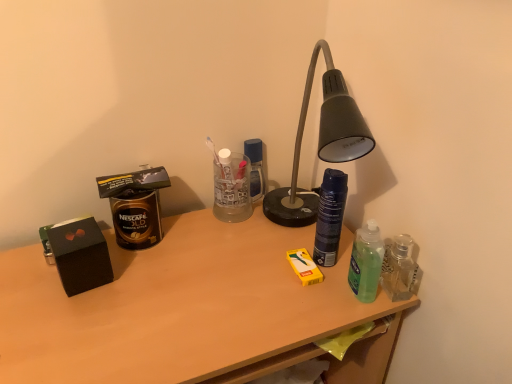
Question: Could you tell me if dark blue matte spray can at center, positioned as the 1th bottle in left-to-right order, is facing wooden desk at center?

Choices:
 (A) yes
 (B) no

Answer: (B)

Question: Is dark blue matte spray can at center, the second bottle from the right, to the right of wooden desk at center from the viewer's perspective?

Choices:
 (A) no
 (B) yes

Answer: (B)

Question: Is dark blue matte spray can at center, the second bottle from the right, smaller than wooden desk at center?

Choices:
 (A) yes
 (B) no

Answer: (A)

Question: Is the depth of dark blue matte spray can at center, positioned as the 1th bottle in left-to-right order, less than that of wooden desk at center?

Choices:
 (A) yes
 (B) no

Answer: (B)

Question: Would you consider dark blue matte spray can at center, positioned as the 1th bottle in left-to-right order, to be distant from wooden desk at center?

Choices:
 (A) no
 (B) yes

Answer: (A)

Question: Considering the positions of gold matte canister at left and wooden desk at center in the image, is gold matte canister at left wider or thinner than wooden desk at center?

Choices:
 (A) thin
 (B) wide

Answer: (A)

Question: Considering the positions of gold matte canister at left and wooden desk at center in the image, is gold matte canister at left bigger or smaller than wooden desk at center?

Choices:
 (A) small
 (B) big

Answer: (A)

Question: From the image's perspective, is gold matte canister at left located above or below wooden desk at center?

Choices:
 (A) above
 (B) below

Answer: (A)

Question: Based on their positions, is gold matte canister at left located to the left or right of wooden desk at center?

Choices:
 (A) left
 (B) right

Answer: (A)

Question: Is wooden desk at center in front of or behind gold matte canister at left in the image?

Choices:
 (A) behind
 (B) front

Answer: (B)

Question: Looking at the image, does wooden desk at center seem bigger or smaller compared to gold matte canister at left?

Choices:
 (A) small
 (B) big

Answer: (B)

Question: Looking at their shapes, would you say wooden desk at center is wider or thinner than gold matte canister at left?

Choices:
 (A) thin
 (B) wide

Answer: (B)

Question: Is wooden desk at center situated inside gold matte canister at left or outside?

Choices:
 (A) outside
 (B) inside

Answer: (A)

Question: Considering the positions of point pos(224,266) and point pos(388,246), is point pos(224,266) closer or farther from the camera than point pos(388,246)?

Choices:
 (A) closer
 (B) farther

Answer: (B)

Question: From a real-world perspective, is wooden desk at center positioned above or below green translucent bottle at right, which is the 2th bottle in left-to-right order?

Choices:
 (A) above
 (B) below

Answer: (B)